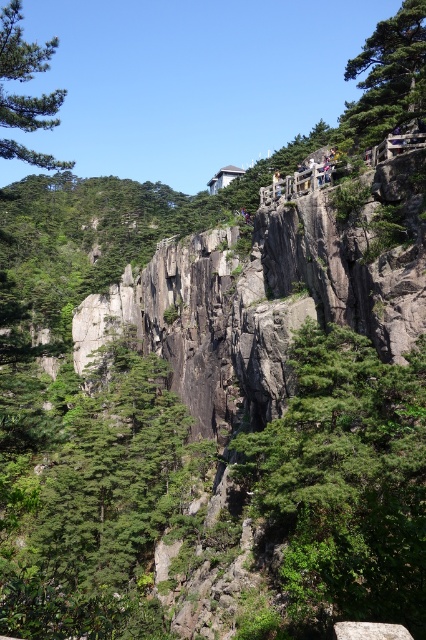
In the scene shown: You are a hiker planning to take a photo of the green matte tree at center and the green matte tree at upper right from the walkway. Which tree will appear higher in your photo?

The green matte tree at upper right will appear higher in the photo because it is positioned above the green matte tree at center.

You are a photographer standing at the base of the cliff, aiming to capture a photo of the green matte tree at upper right. The camera you are using has a maximum focus range of 40 meters. Will the tree be in focus?

The green matte tree at upper right is 39.17 meters from the camera, which is within the maximum focus range of 40 meters. Therefore, the tree will be in focus.

You are a hiker planning to take a photo of the mountain landscape. You want to frame the scene so that both the green matte tree at upper right and the green matte tree at upper left are visible. Which tree should you position closer to the edge of your camera frame to ensure both are included?

You should position the green matte tree at upper right closer to the edge of your camera frame because it is smaller than the green matte tree at upper left, allowing more space for the larger tree while keeping both visible.